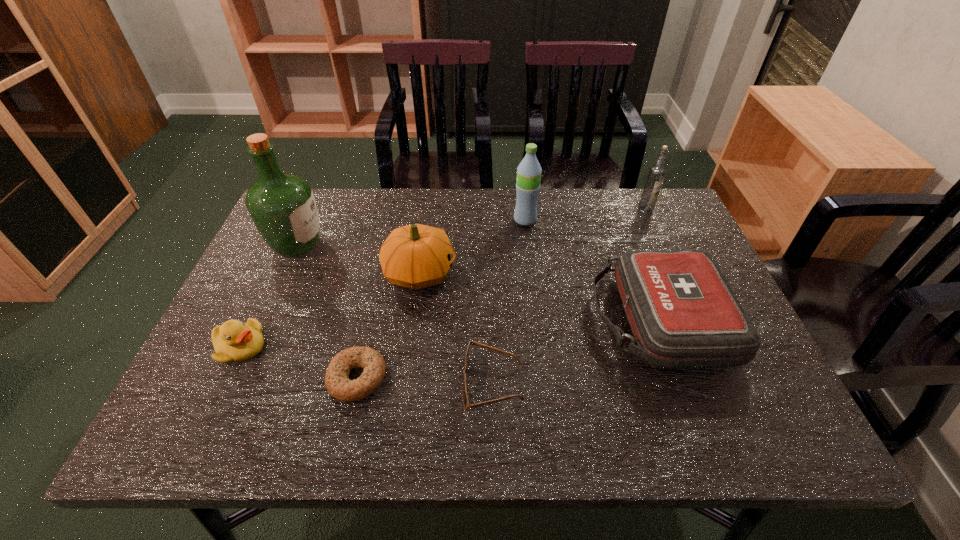
The width and height of the screenshot is (960, 540). I want to click on free location located 0.290m on the right of the water bottle, so click(x=636, y=220).

Where is `vacant space situated on the label of the vodka`? This screenshot has height=540, width=960. vacant space situated on the label of the vodka is located at coordinates (692, 314).

At what (x,y) coordinates should I click in order to perform the action: click on blank space located 0.330m on the side of the fifth shortest object with the carved face. Please return your answer as a coordinate pair (x, y). Image resolution: width=960 pixels, height=540 pixels. Looking at the image, I should click on click(585, 273).

Image resolution: width=960 pixels, height=540 pixels. Find the location of `vacant space located on the front of the first-aid kit`. vacant space located on the front of the first-aid kit is located at coordinates (697, 424).

I want to click on free space located on the front-facing side of the sixth tallest object, so click(342, 347).

Identify the location of vacant region located on the frames of the fourth object from right to left. (405, 383).

I want to click on free spot located on the frames of the fourth object from right to left, so click(x=356, y=383).

Where is `vacant area situated 0.200m on the frames of the fourth object from right to left`? The height and width of the screenshot is (540, 960). vacant area situated 0.200m on the frames of the fourth object from right to left is located at coordinates (366, 383).

Where is `vacant space positioned 0.080m on the right of the bagel`? The width and height of the screenshot is (960, 540). vacant space positioned 0.080m on the right of the bagel is located at coordinates click(x=424, y=377).

Where is `liquor at the far edge`? The width and height of the screenshot is (960, 540). liquor at the far edge is located at coordinates (282, 206).